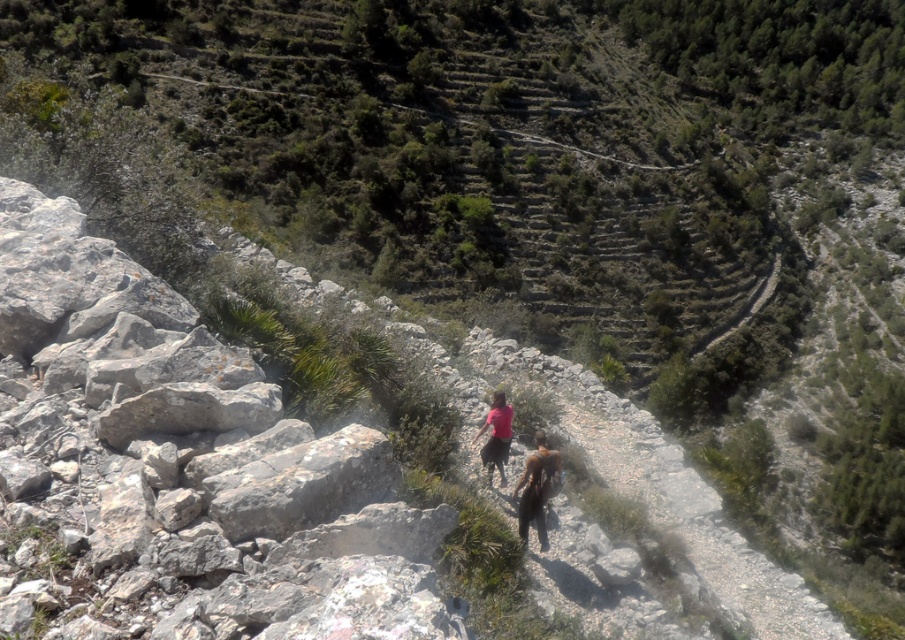
You are standing at the starting point of the path in the rugged terrain and want to reach a destination marked by point (489, 474). There is an obstacle at point (58, 392). Can you safely walk around the obstacle without getting too close?

Point (58, 392) is closer to the viewer than point (489, 474). Since the obstacle is closer, you can walk around it by moving to the side before proceeding towards the destination point (489, 474).

You are a hiker trying to decide which item to grab first from the center of the path. The dark brown leather jacket at center and the matte pink shirt at center are both in your way. Which one is taller and easier to step over?

The dark brown leather jacket at center is taller than the matte pink shirt at center, so it is easier to step over.

You are standing at the center of the image and want to move towards the gray rough rock at left. In which direction should you move?

The gray rough rock at left is located at point (186, 465) in the image. Since you are at the center, you should move towards the left direction to reach it.